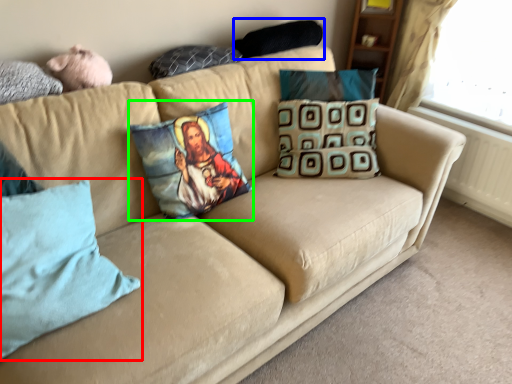
Question: Which object is positioned farthest from pillow (highlighted by a red box)? Select from pillow (highlighted by a blue box) and pillow (highlighted by a green box).

Choices:
 (A) pillow
 (B) pillow

Answer: (A)